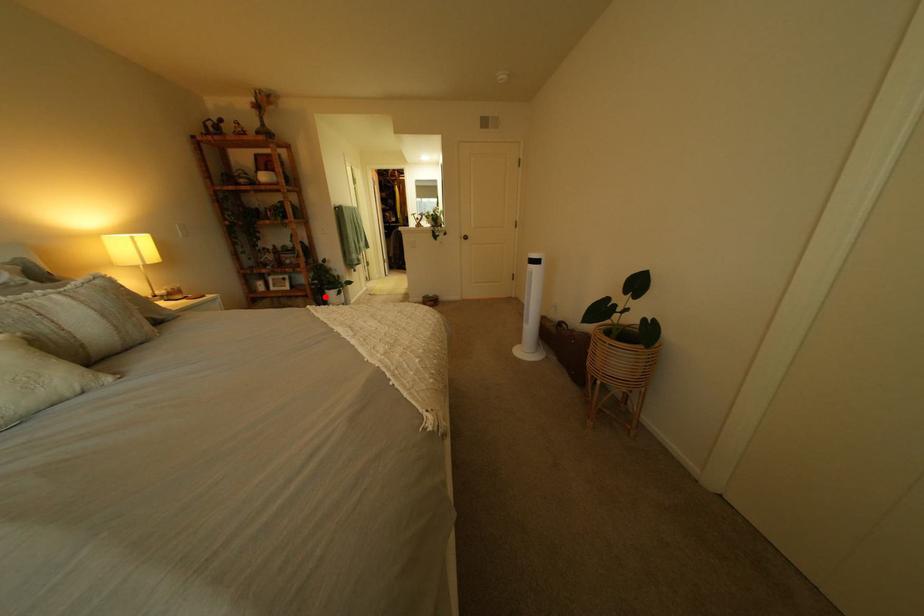
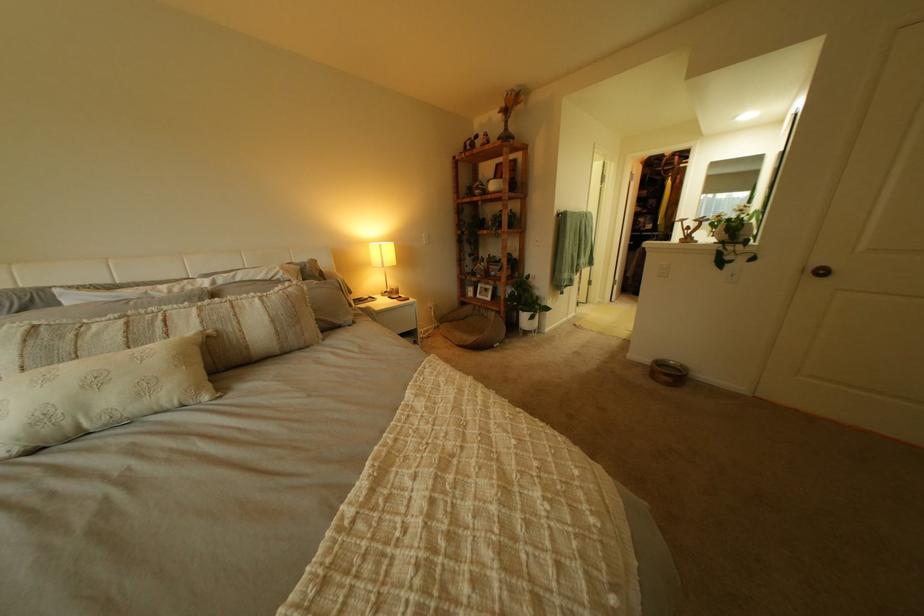
Question: I am providing you with two images of the same scene from different viewpoints. Given a red point in image1, look at the same physical point in image2. Is it:

Choices:
 (A) Closer to the viewpoint
 (B) Farther from the viewpoint

Answer: (B)